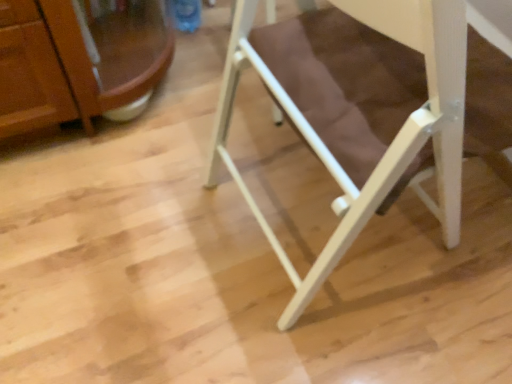
Identify the location of vacant space situated on the left part of matte brown cushion at center. (151, 213).